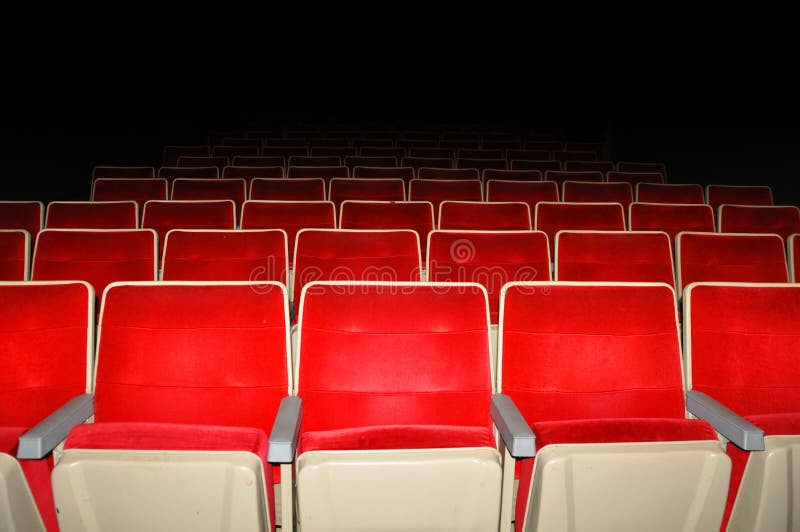
You are a GUI agent. You are given a task and a screenshot of the screen. Output one action in this format:
    pyautogui.click(x=<x>, y=<y>)
    Task: Click on the arm rests
    Image resolution: width=800 pixels, height=532 pixels.
    Given the screenshot: What is the action you would take?
    pyautogui.click(x=52, y=431), pyautogui.click(x=285, y=422), pyautogui.click(x=514, y=421), pyautogui.click(x=745, y=430)